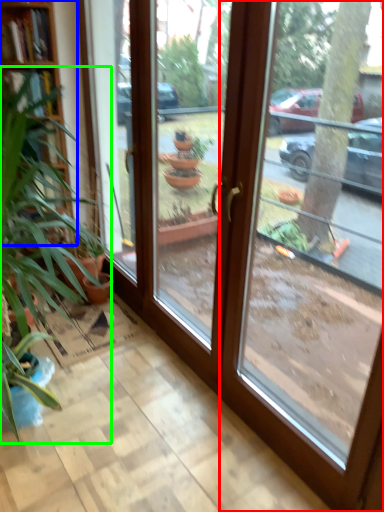
Question: Based on their relative distances, which object is nearer to window (highlighted by a red box)? Choose from bookshelf (highlighted by a blue box) and houseplant (highlighted by a green box).

Choices:
 (A) bookshelf
 (B) houseplant

Answer: (B)